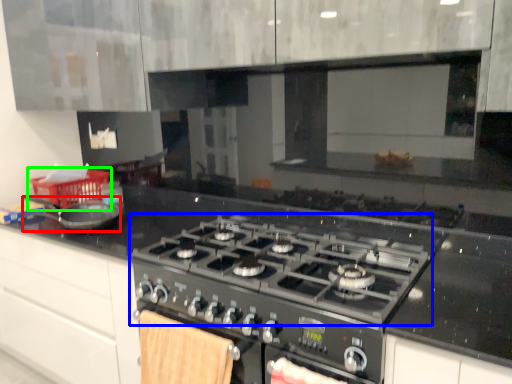
Question: Which object is the farthest from kitchen appliance (highlighted by a red box)? Choose among these: gas stove (highlighted by a blue box) or basket (highlighted by a green box).

Choices:
 (A) gas stove
 (B) basket

Answer: (A)